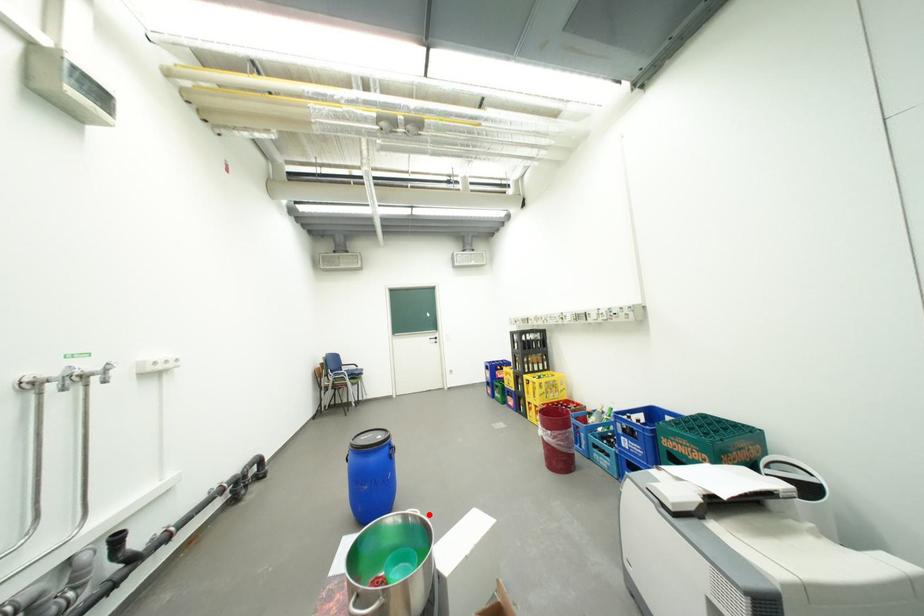
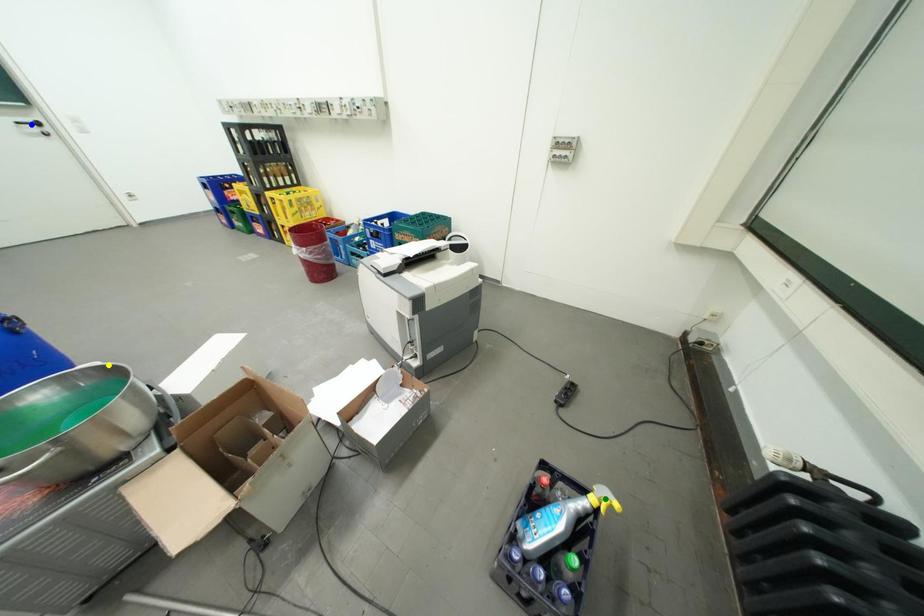
Question: I am providing you with two images of the same scene from different viewpoints. A red point is marked on the first image. You are given multiple points on the second image. In image 2, which mark is for the same physical point as the one in image 1?

Choices:
 (A) green point
 (B) yellow point
 (C) blue point

Answer: (B)